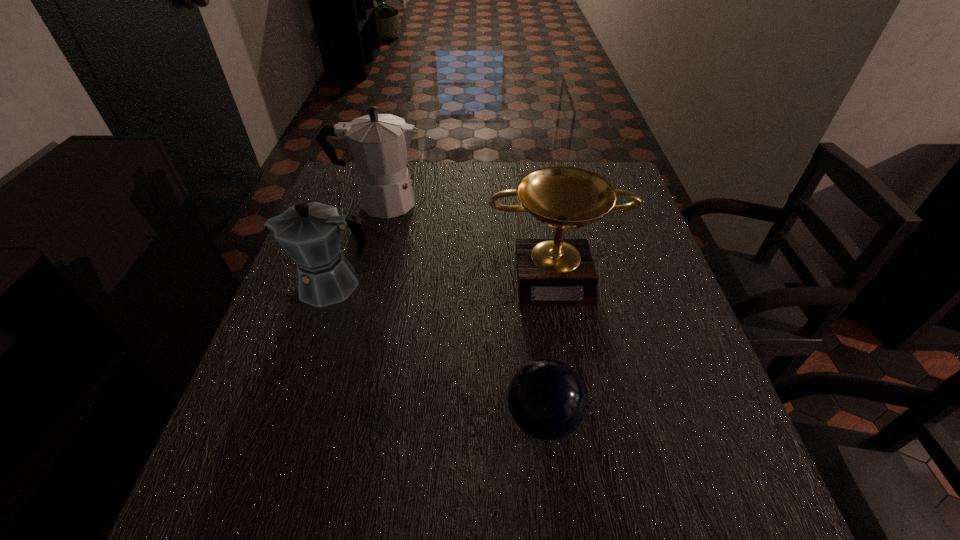
At what (x,y) coordinates should I click in order to perform the action: click on the farthest object. Please return your answer as a coordinate pair (x, y). This screenshot has height=540, width=960. Looking at the image, I should click on (379, 143).

Locate an element on the screen. The width and height of the screenshot is (960, 540). the taller coffeepot is located at coordinates pyautogui.click(x=379, y=143).

The width and height of the screenshot is (960, 540). Identify the location of award. [x=550, y=272].

Where is `the shorter coffeepot`? the shorter coffeepot is located at coordinates (310, 233).

The width and height of the screenshot is (960, 540). In order to click on bowling ball in this screenshot , I will do `click(547, 400)`.

The height and width of the screenshot is (540, 960). Identify the location of the shortest object. (547, 400).

This screenshot has width=960, height=540. I want to click on free space located 0.310m at the spout of the farther coffeepot, so click(x=532, y=202).

The height and width of the screenshot is (540, 960). I want to click on free region located 0.320m on the front-facing side of the award, so click(x=583, y=442).

Image resolution: width=960 pixels, height=540 pixels. I want to click on vacant space located on the surface of the nearest object near the finger holes, so click(393, 418).

Where is `vacant area located on the surface of the nearest object near the finger holes`? The width and height of the screenshot is (960, 540). vacant area located on the surface of the nearest object near the finger holes is located at coordinates (290, 418).